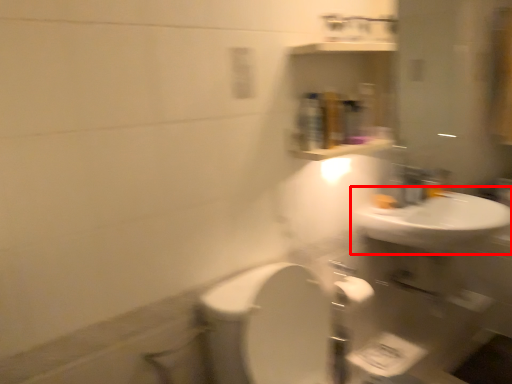
Question: From the image's perspective, what is the correct spatial relationship of sink (annotated by the red box) in relation to faucet?

Choices:
 (A) below
 (B) above

Answer: (A)